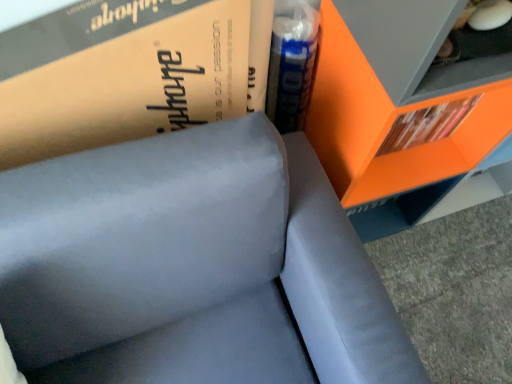
Question: Should I look upward or downward to see translucent plastic bottle at upper right?

Choices:
 (A) up
 (B) down

Answer: (A)